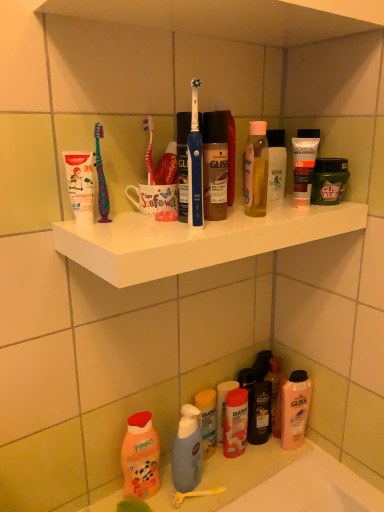
I want to click on free space that is to the left of pink matte shampoo at lower right, the first cleaning product viewed from the right, so click(246, 464).